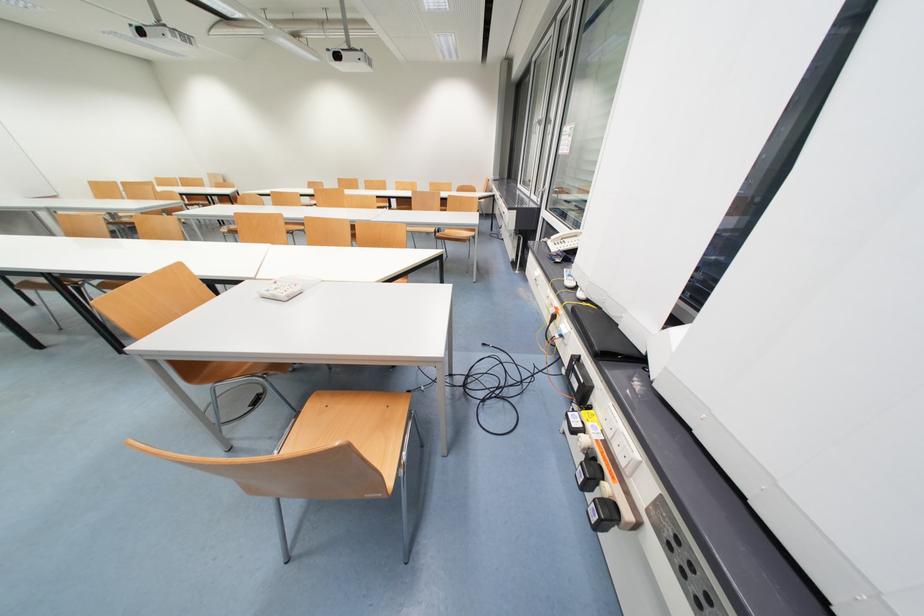
Locate an element on the screen. wooden chair sitting surface is located at coordinates (432, 411).